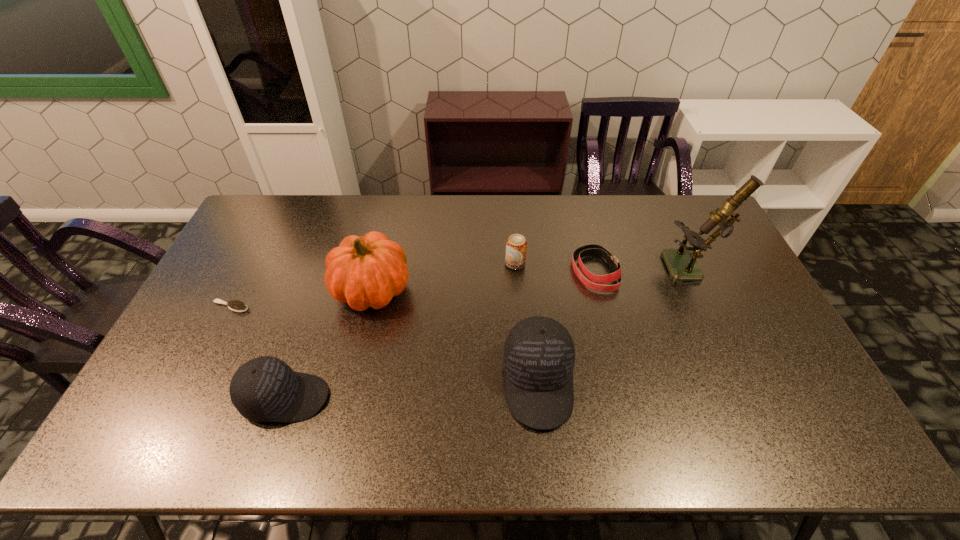
Find the location of a particular element. This screenshot has height=540, width=960. vacant area that lies between the rightmost object and the second tallest object is located at coordinates (533, 280).

You are a GUI agent. You are given a task and a screenshot of the screen. Output one action in this format:
    pyautogui.click(x=<x>, y=<y>)
    Task: Click on the vacant space that's between the sixth shortest object and the shorter baseball cap
    Image resolution: width=960 pixels, height=540 pixels.
    Given the screenshot: What is the action you would take?
    pyautogui.click(x=328, y=344)

Where is `free space that is in between the pumpkin and the rightmost object`? free space that is in between the pumpkin and the rightmost object is located at coordinates (533, 280).

I want to click on blank region between the shortest object and the sixth tallest object, so click(x=413, y=289).

The width and height of the screenshot is (960, 540). I want to click on vacant area that lies between the sixth object from left to right and the tallest object, so [644, 271].

Find the location of a particular element. This screenshot has width=960, height=540. free spot between the sixth tallest object and the beer can is located at coordinates (555, 268).

Locate which object is the second closest to the beer can. Please provide its 2D coordinates. Your answer should be formatted as a tuple, i.e. [(x, y)], where the tuple contains the x and y coordinates of a point satisfying the conditions above.

[(538, 358)]

Find the location of a particular element. object that is the fifth closest to the tallest object is located at coordinates (265, 389).

Where is `vacant space that satisfies the following two spatial constraints: 1. on the back side of the beer can; 2. on the left side of the scrubbing brush`? vacant space that satisfies the following two spatial constraints: 1. on the back side of the beer can; 2. on the left side of the scrubbing brush is located at coordinates (252, 264).